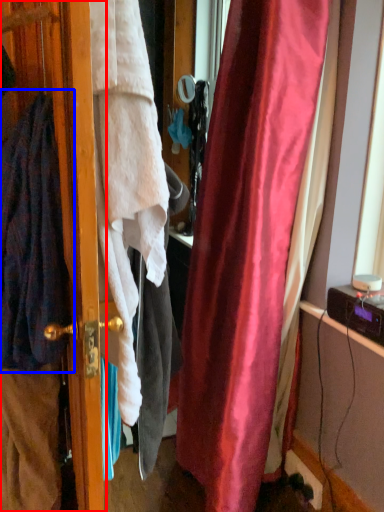
Question: Among these objects, which one is farthest to the camera, screen door (highlighted by a red box) or cardigan (highlighted by a blue box)?

Choices:
 (A) screen door
 (B) cardigan

Answer: (B)